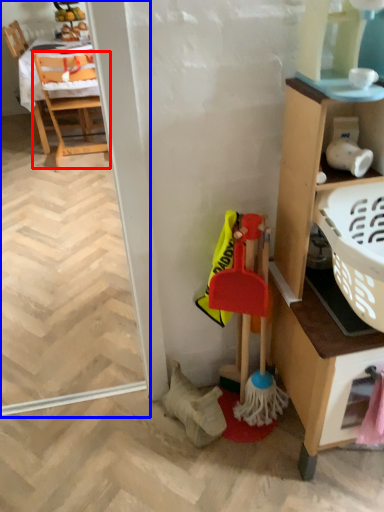
Question: Among these objects, which one is nearest to the camera, chair (highlighted by a red box) or screen door (highlighted by a blue box)?

Choices:
 (A) chair
 (B) screen door

Answer: (B)